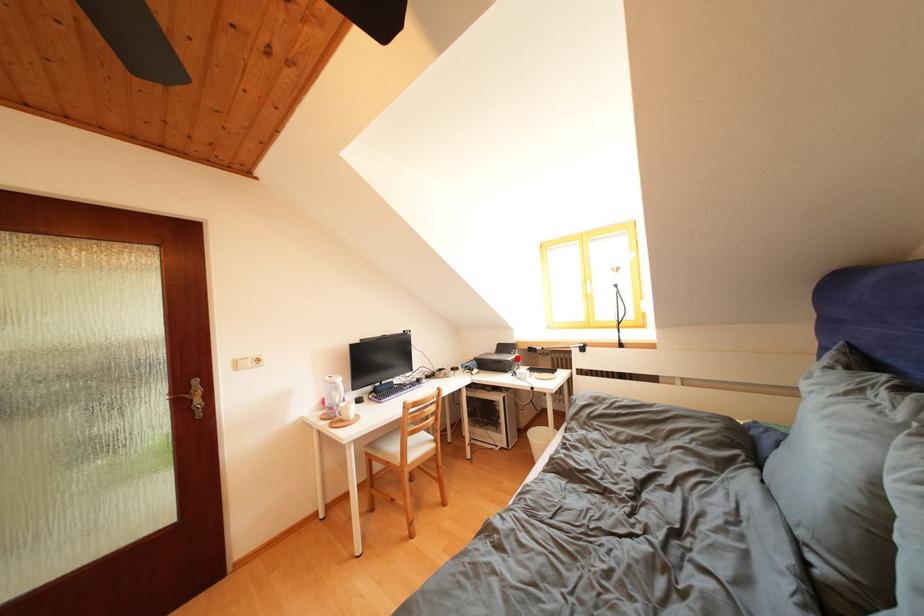
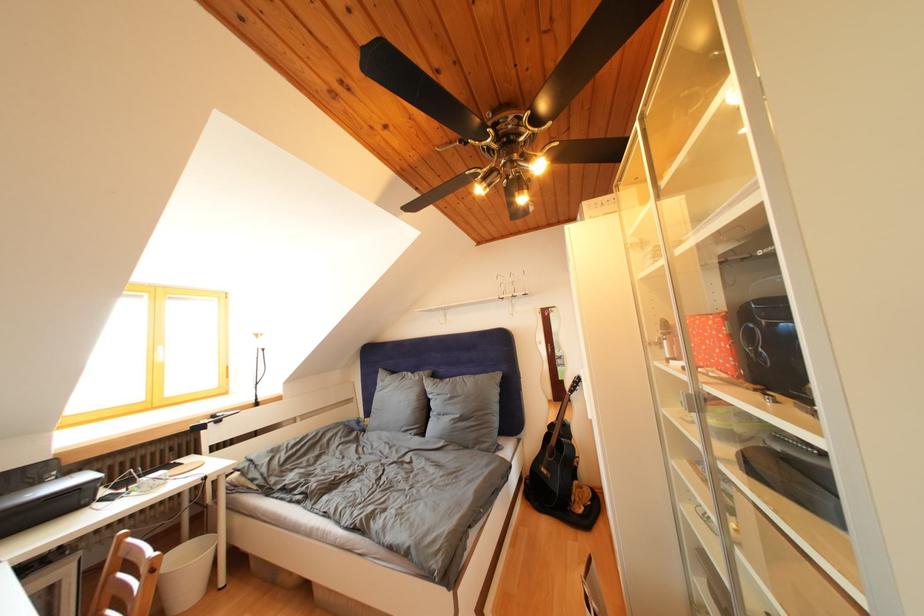
Question: I am providing you with two images of the same scene from different viewpoints. A red point is shown in image1. For the corresponding object point in image2, is it positioned nearer or farther from the camera?

Choices:
 (A) Nearer
 (B) Farther

Answer: (A)